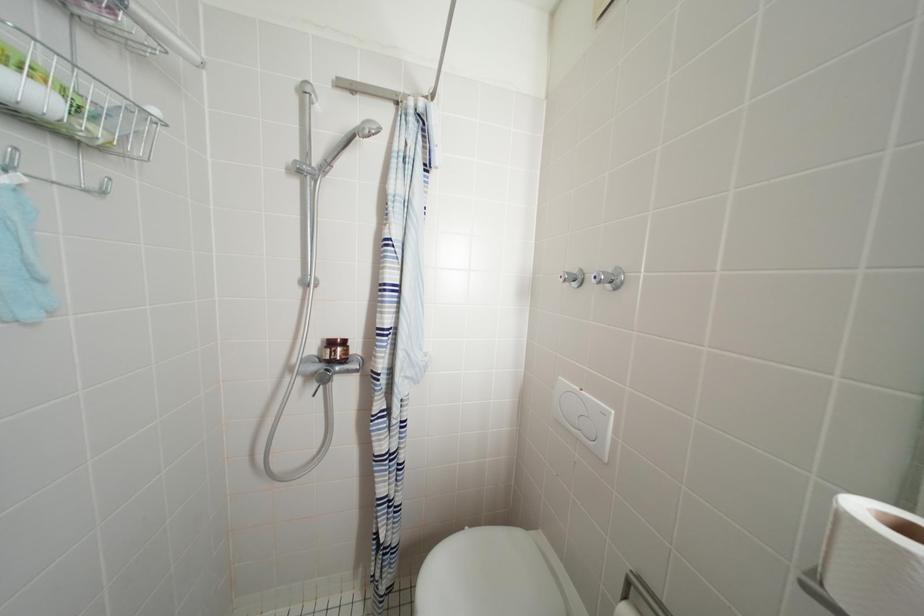
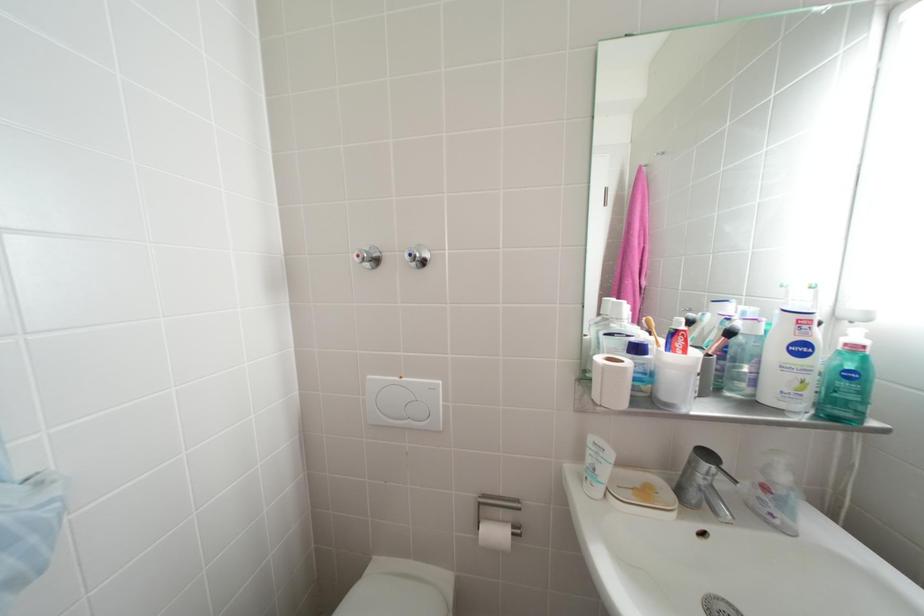
Question: The camera is either moving clockwise (left) or counter-clockwise (right) around the object. The first image is from the beginning of the video and the second image is from the end. Is the camera moving left or right when shooting the video?

Choices:
 (A) Left
 (B) Right

Answer: (A)